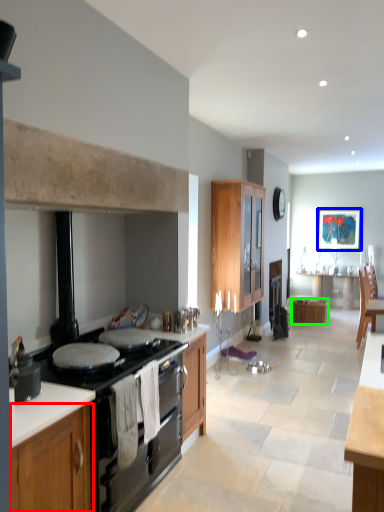
Question: Estimate the real-world distances between objects in this image. Which object is closer to cabinetry (highlighted by a red box), picture frame (highlighted by a blue box) or cabinetry (highlighted by a green box)?

Choices:
 (A) picture frame
 (B) cabinetry

Answer: (B)